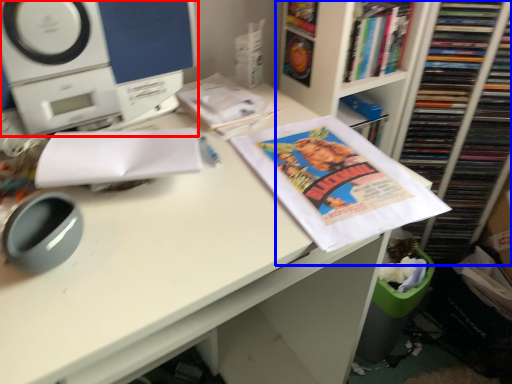
Question: Which object appears farthest to the camera in this image, home appliance (highlighted by a red box) or bookcase (highlighted by a blue box)?

Choices:
 (A) home appliance
 (B) bookcase

Answer: (B)